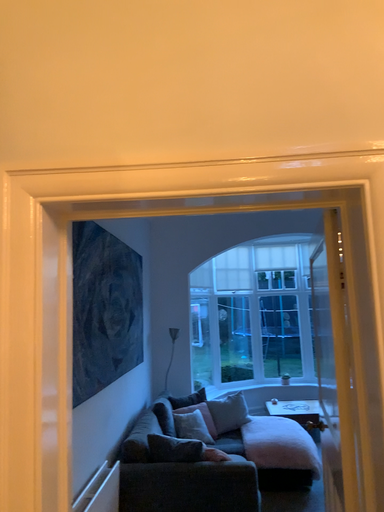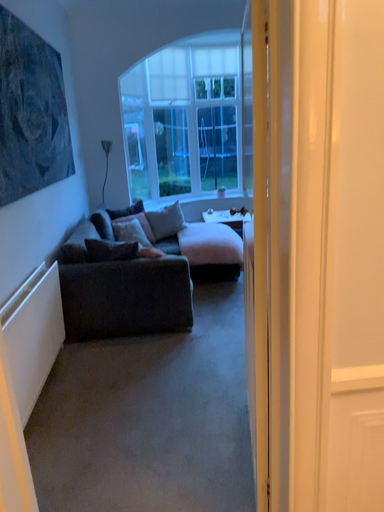
Question: Which way did the camera rotate in the video?

Choices:
 (A) rotated upward
 (B) rotated downward

Answer: (B)